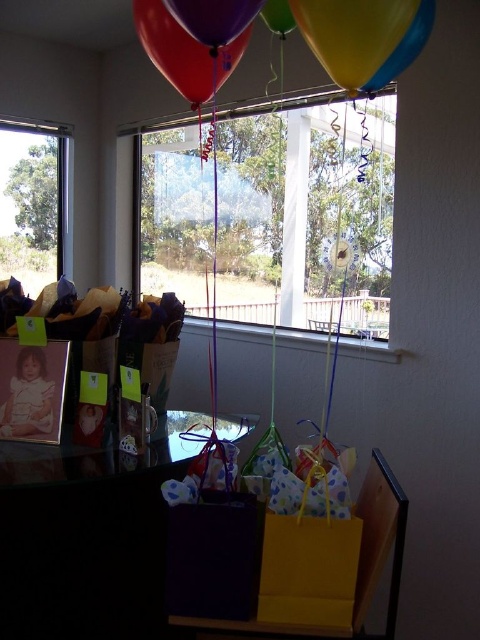
Can you confirm if clear glass window at upper left is taller than green matte balloon at upper center?

Correct, clear glass window at upper left is much taller as green matte balloon at upper center.

How much distance is there between clear glass window at upper left and green matte balloon at upper center?

The distance of clear glass window at upper left from green matte balloon at upper center is 6.68 feet.

Is point (4, 228) closer to camera compared to point (282, 19)?

No.

I want to click on clear glass window at upper left, so click(x=35, y=202).

Does point (217, 312) come in front of point (272, 19)?

No, (217, 312) is further to viewer.

Is point (317, 294) more distant than point (277, 26)?

Yes.

Locate an element on the screen. Image resolution: width=480 pixels, height=640 pixels. transparent glass window at center is located at coordinates (307, 214).

Does shiny blue balloon at upper right have a lesser height compared to green matte balloon at upper center?

No.

Is point (412, 42) positioned before point (276, 17)?

Yes, point (412, 42) is in front of point (276, 17).

At what (x,y) coordinates should I click in order to perform the action: click on shiny blue balloon at upper right. Please return your answer as a coordinate pair (x, y). Image resolution: width=480 pixels, height=640 pixels. Looking at the image, I should click on (405, 48).